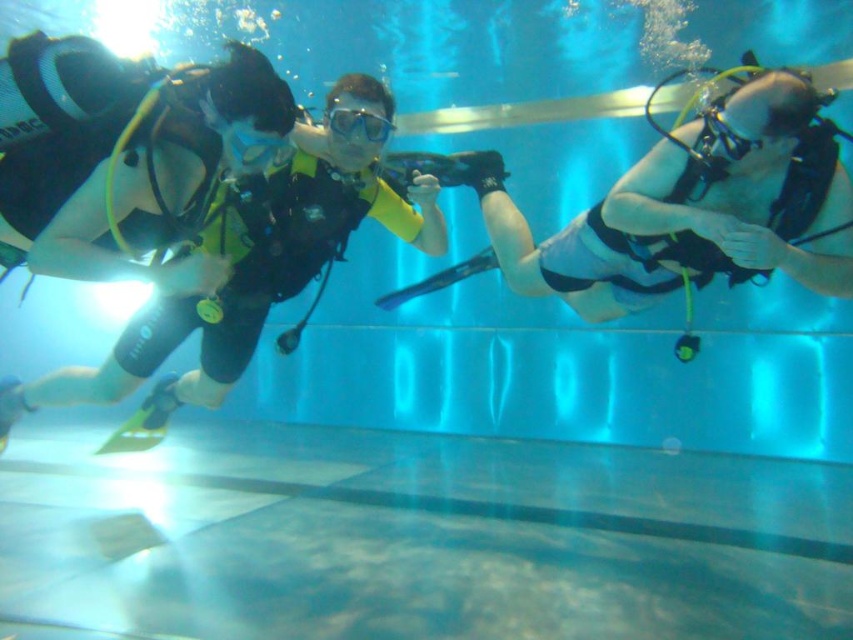
You are a safety inspector assessing the underwater scene. You notice the black matte scuba diver at center and the transparent rubber goggles at center. According to safety protocols, the goggles must be positioned closer to the diver than their face. Is this requirement being met?

The black matte scuba diver at center is further to the viewer than transparent rubber goggles at center, meaning the goggles are closer to the diver than their face. Therefore, the requirement is being met.

You are a lifeguard at the pool and need to ensure all divers are properly spaced. The pool has a width restriction of 1.2 meters between divers. Given the black matte scuba diver at center and the transparent rubber goggles at center, can both fit within the width restriction without violating it?

The black matte scuba diver at center is wider than the transparent rubber goggles at center. Since the pool requires a minimum of 1.2 meters between divers, the total width of both objects combined must be less than 1.2 meters. However, without knowing the exact widths of each, it is impossible to determine if they fit within the restriction. Please measure their widths and recalculate.

You are a scuba instructor assessing the equipment of two divers in the center of the pool. You notice the matte black scuba gear at center and the clear plastic goggles at center. Which piece of equipment is bigger?

The matte black scuba gear at center is larger in size than the clear plastic goggles at center.